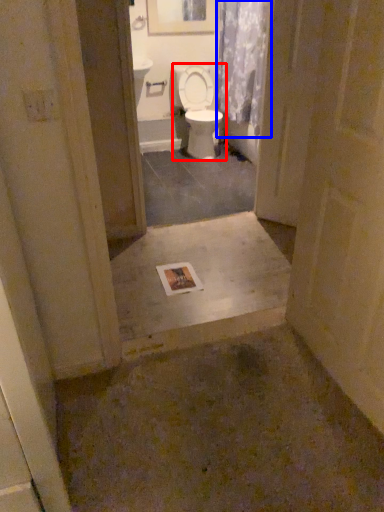
Question: Which object appears closest to the camera in this image, toilet (highlighted by a red box) or shower curtain (highlighted by a blue box)?

Choices:
 (A) toilet
 (B) shower curtain

Answer: (B)